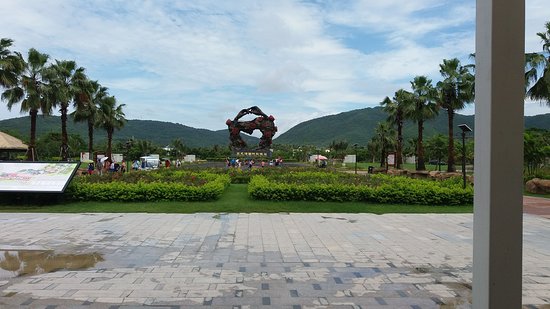
Find the location of a particular element. The height and width of the screenshot is (309, 550). gray tiled flooring is located at coordinates (286, 276).